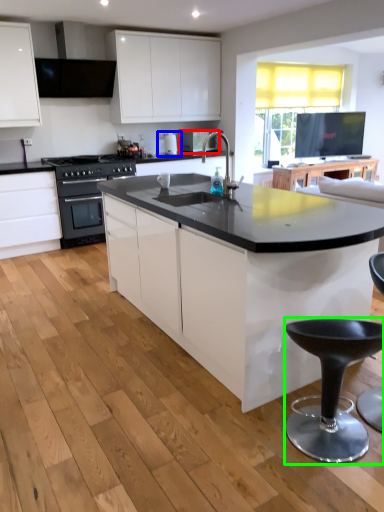
Question: Which is nearer to the appliance (highlighted by a red box)? coffee machine (highlighted by a blue box) or bar stool (highlighted by a green box).

Choices:
 (A) coffee machine
 (B) bar stool

Answer: (A)